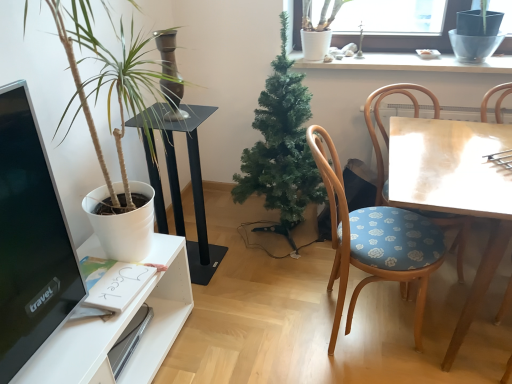
You are a GUI agent. You are given a task and a screenshot of the screen. Output one action in this format:
    pyautogui.click(x=<x>, y=<y>)
    Task: Click on the vacant space underneath wooden chair with blue floral cushion at right, arranged as the second chair when viewed from the right (from a real-world perspective)
    Image resolution: width=512 pixels, height=384 pixels.
    Given the screenshot: What is the action you would take?
    pyautogui.click(x=345, y=324)